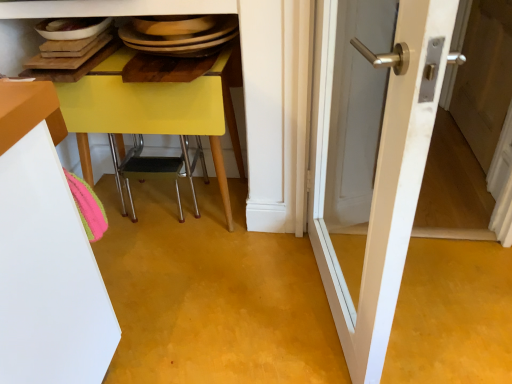
Where is `vacant area that is situated to the right of white glossy door at center`? vacant area that is situated to the right of white glossy door at center is located at coordinates (438, 296).